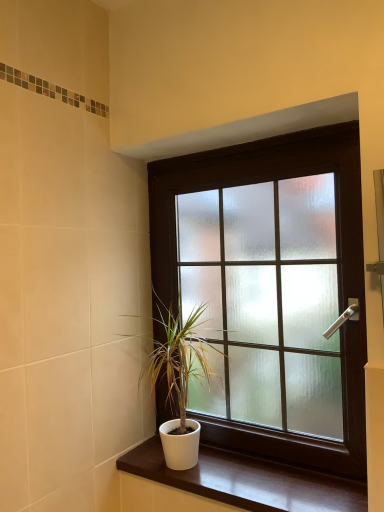
Question: Can you confirm if white glossy wood at lower center is thinner than frosted glass window at center?

Choices:
 (A) yes
 (B) no

Answer: (B)

Question: Is white glossy wood at lower center further to camera compared to frosted glass window at center?

Choices:
 (A) yes
 (B) no

Answer: (B)

Question: Does white glossy wood at lower center contain frosted glass window at center?

Choices:
 (A) yes
 (B) no

Answer: (B)

Question: Is white glossy wood at lower center positioned far away from frosted glass window at center?

Choices:
 (A) no
 (B) yes

Answer: (A)

Question: Does white glossy wood at lower center have a greater width compared to frosted glass window at center?

Choices:
 (A) yes
 (B) no

Answer: (A)

Question: Looking at the image, does frosted glass window at center seem bigger or smaller compared to white glossy wood at lower center?

Choices:
 (A) big
 (B) small

Answer: (A)

Question: From the image's perspective, relative to white glossy wood at lower center, is frosted glass window at center above or below?

Choices:
 (A) above
 (B) below

Answer: (A)

Question: Is frosted glass window at center taller or shorter than white glossy wood at lower center?

Choices:
 (A) short
 (B) tall

Answer: (B)

Question: Is point (289, 274) closer or farther from the camera than point (218, 495)?

Choices:
 (A) closer
 (B) farther

Answer: (B)

Question: From their relative heights in the image, would you say white glossy wood at lower center is taller or shorter than frosted glass window at center?

Choices:
 (A) short
 (B) tall

Answer: (A)

Question: Which is correct: white glossy wood at lower center is inside frosted glass window at center, or outside of it?

Choices:
 (A) outside
 (B) inside

Answer: (A)

Question: Is point (226, 494) closer or farther from the camera than point (312, 296)?

Choices:
 (A) farther
 (B) closer

Answer: (B)

Question: Relative to frosted glass window at center, is white glossy wood at lower center in front or behind?

Choices:
 (A) front
 (B) behind

Answer: (A)

Question: From a real-world perspective, relative to frosted glass window at center, is white matte pot at lower center vertically above or below?

Choices:
 (A) above
 (B) below

Answer: (B)

Question: Considering the positions of point (183, 466) and point (223, 231), is point (183, 466) closer or farther from the camera than point (223, 231)?

Choices:
 (A) closer
 (B) farther

Answer: (A)